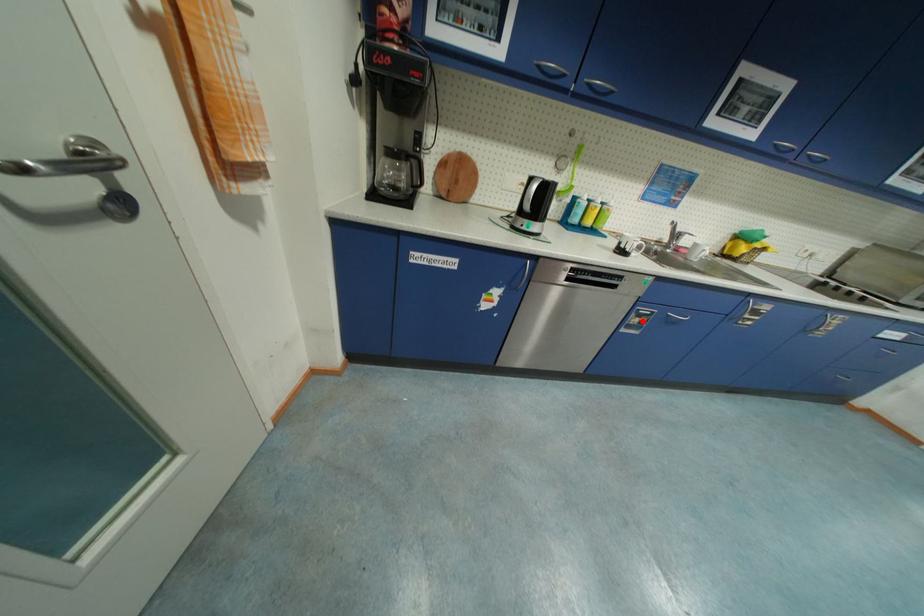
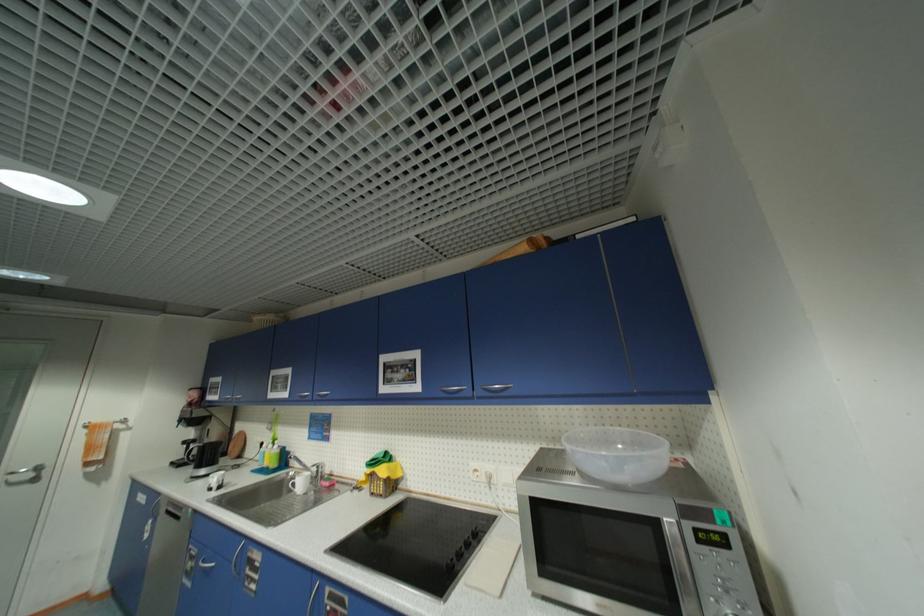
Question: I am providing you with two images of the same scene from different viewpoints. In image1, a red point is highlighted. Considering the same 3D point in image2, which of the following is correct?

Choices:
 (A) It is closer
 (B) It is farther

Answer: (A)